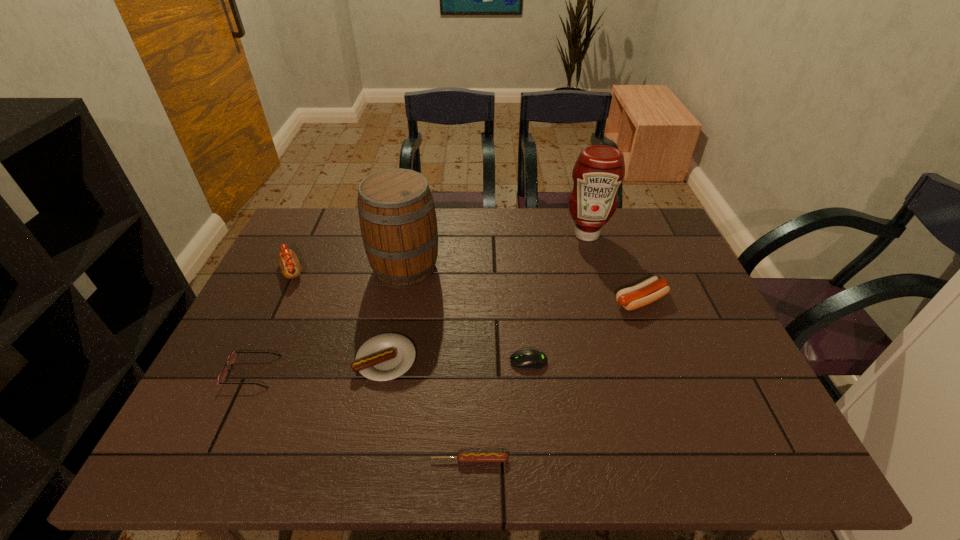
Where is `the nearest object`? This screenshot has width=960, height=540. the nearest object is located at coordinates pos(463,457).

Where is `vacant area situated on the front of the condiment`? vacant area situated on the front of the condiment is located at coordinates (601, 280).

Find the location of a particular element. vacant point located 0.160m on the left of the cider is located at coordinates (317, 268).

The width and height of the screenshot is (960, 540). Identify the location of vacant area situated on the front of the leftmost sausage. [x=258, y=341].

This screenshot has height=540, width=960. I want to click on free space located 0.280m on the left of the second farthest sausage, so click(512, 301).

This screenshot has height=540, width=960. I want to click on vacant position located on the front of the third farthest sausage, so click(376, 408).

You are a GUI agent. You are given a task and a screenshot of the screen. Output one action in this format:
    pyautogui.click(x=<x>, y=<y>)
    Task: Click on the blank space located on the bridge of the sunglasses
    Image resolution: width=960 pixels, height=540 pixels.
    Given the screenshot: What is the action you would take?
    pyautogui.click(x=330, y=372)

Identify the location of blank space located 0.100m on the wheel side of the computer mouse. This screenshot has width=960, height=540. (468, 361).

Image resolution: width=960 pixels, height=540 pixels. I want to click on free region located 0.100m on the wheel side of the computer mouse, so click(x=468, y=361).

Image resolution: width=960 pixels, height=540 pixels. I want to click on vacant area located on the wheel side of the computer mouse, so click(468, 361).